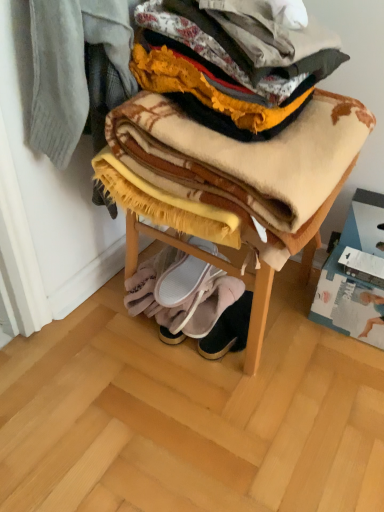
The width and height of the screenshot is (384, 512). Identify the location of vacant area in front of white fabric slipper at lower center, the second footwear viewed from the top. (212, 372).